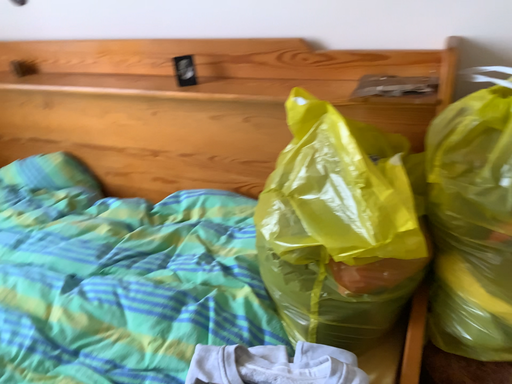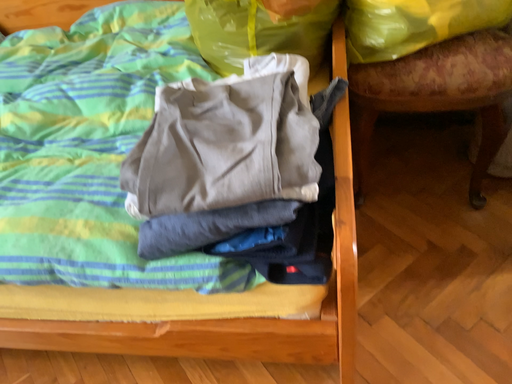
Question: How did the camera likely rotate when shooting the video?

Choices:
 (A) rotated right
 (B) rotated left

Answer: (A)